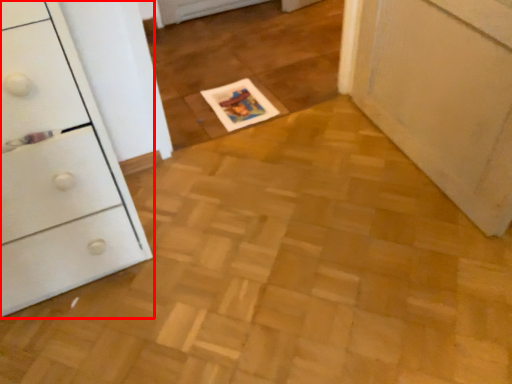
Question: Considering the relative positions of chest of drawers (annotated by the red box) and magazine in the image provided, where is chest of drawers (annotated by the red box) located with respect to the staircase?

Choices:
 (A) left
 (B) right

Answer: (A)